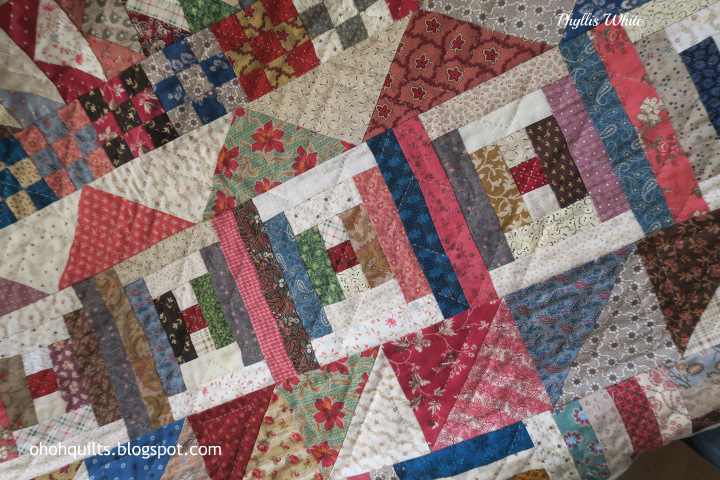
The image size is (720, 480). In order to click on table in this screenshot , I will do `click(697, 471)`.